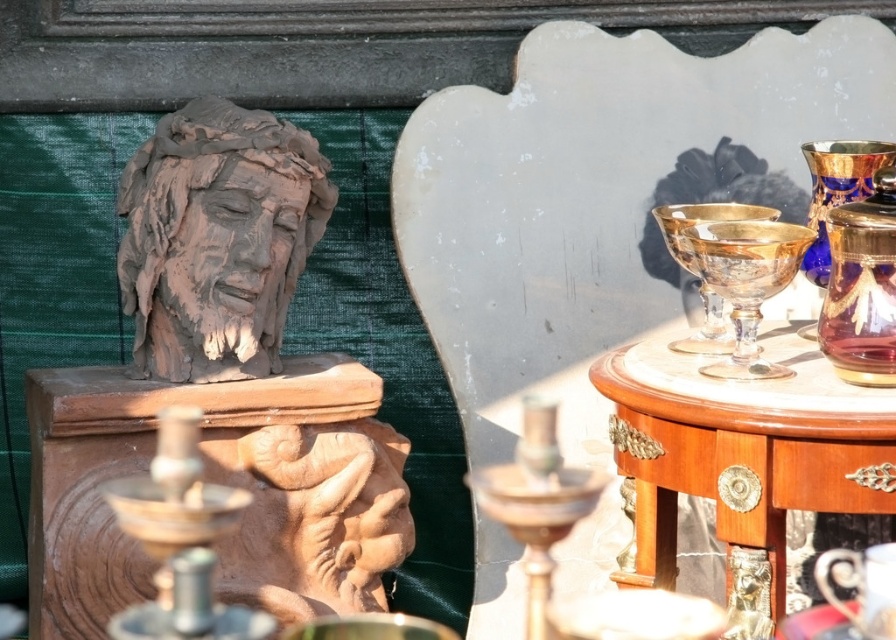
You are standing at the camera position and want to take a photo of the terracotta statue at left. If your camera has a maximum focus range of 4 meters, will you be able to capture the statue clearly?

The terracotta statue at left and camera are 4.34 meters apart from each other, which exceeds the camera maximum focus range of 4 meters. Therefore, you won me capture the statue clearly.

From the picture: You are setting up a display and need to place both the bronze metallic candle holder at lower left and the gold glass candle holder at right on a shelf. Which candle holder should you place first if you want to ensure both fit without overlapping?

The bronze metallic candle holder at lower left is larger in size than the gold glass candle holder at right, so you should place the bronze metallic candle holder at lower left first to ensure there is enough space for both.